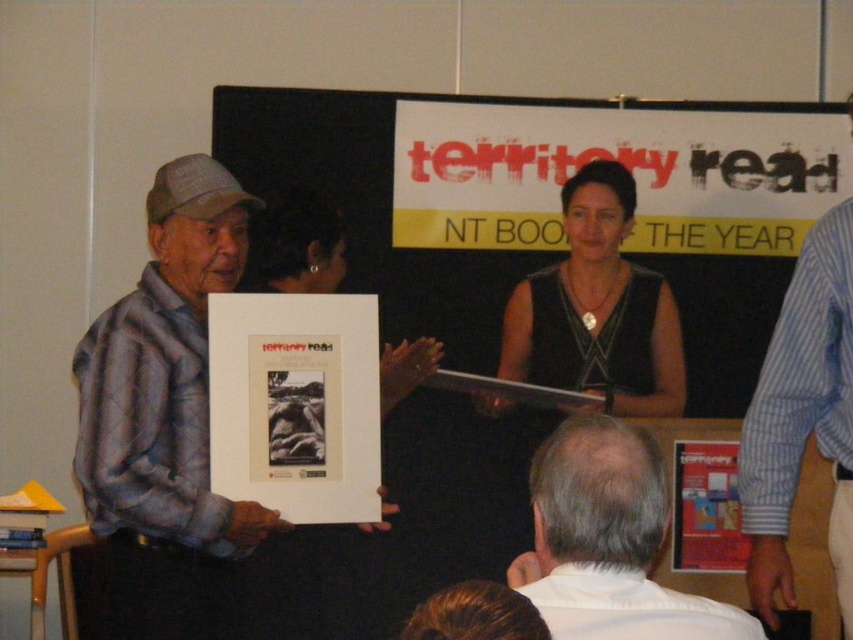
You are a photographer at the event and need to capture a photo that includes both the plaid shirt at left and the black fabric dress at center. What is the minimum distance you need to move backward to ensure both are in frame?

The plaid shirt at left and black fabric dress at center are 3.63 feet apart. To include both in the frame, you need to move backward at least 3.63 feet from the closest object to ensure the entire distance between them fits within the camera view.

You are attending the award ceremony and need to take a photo of the presenter. The presenter is wearing a plaid shirt at left and there is someone with a blue striped shirt at upper right. Which person should you focus on to capture the presenter?

The presenter is the person wearing the plaid shirt at left, so you should focus on the plaid shirt at left to capture the presenter.